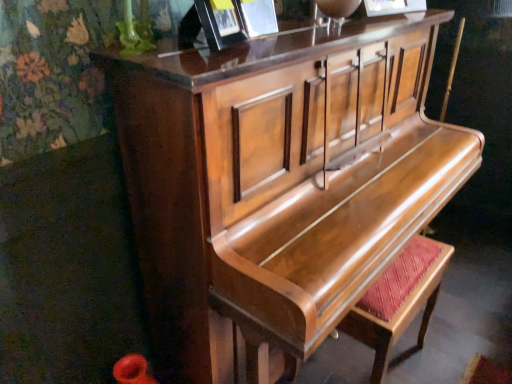
At what (x,y) coordinates should I click in order to perform the action: click on vacant area that lies to the right of wooden armchair at lower right. Please return your answer as a coordinate pair (x, y). Looking at the image, I should click on (458, 345).